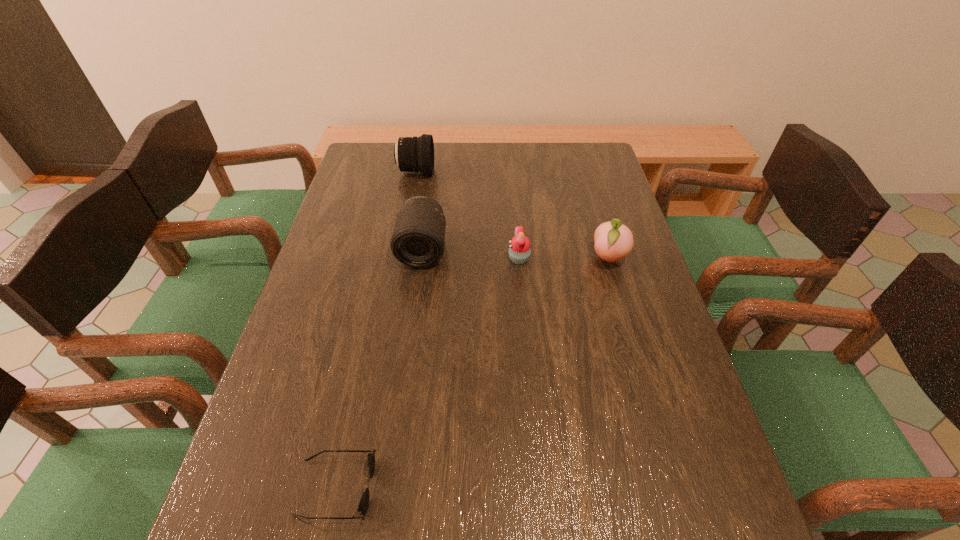
At what (x,y) coordinates should I click in order to perform the action: click on vacant space at the right edge of the desktop. Please return your answer as a coordinate pair (x, y). Looking at the image, I should click on (604, 281).

Find the location of `vacant space at the far left corner of the desktop`. vacant space at the far left corner of the desktop is located at coordinates (385, 158).

This screenshot has height=540, width=960. I want to click on free point at the far right corner, so [596, 144].

The image size is (960, 540). In order to click on free space that is in between the farther telephoto lens and the rightmost object in this screenshot , I will do `click(513, 215)`.

Identify the location of vacant space in between the rightmost object and the farther telephoto lens. The width and height of the screenshot is (960, 540). (513, 215).

Where is `vacant area that lies between the shortest object and the peach`? Image resolution: width=960 pixels, height=540 pixels. vacant area that lies between the shortest object and the peach is located at coordinates (472, 373).

Where is `free area in between the farther telephoto lens and the cupcake`? The width and height of the screenshot is (960, 540). free area in between the farther telephoto lens and the cupcake is located at coordinates (468, 215).

I want to click on free area in between the fourth object from left to right and the farthest object, so click(x=468, y=215).

Image resolution: width=960 pixels, height=540 pixels. I want to click on empty space between the farthest object and the shortest object, so click(376, 329).

At what (x,y) coordinates should I click in order to perform the action: click on unoccupied area between the nearer telephoto lens and the nearest object. Please return your answer as a coordinate pair (x, y). This screenshot has height=540, width=960. Looking at the image, I should click on click(379, 368).